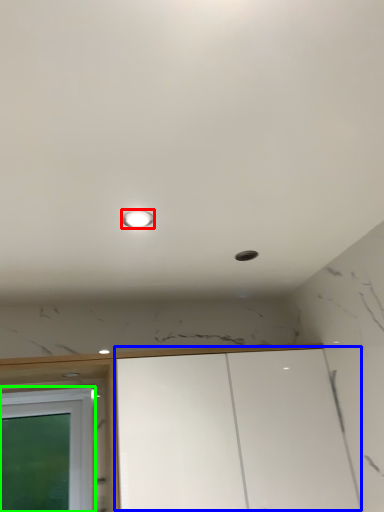
Question: Considering the real-world distances, which object is closest to light (highlighted by a red box)? cabinetry (highlighted by a blue box) or window (highlighted by a green box).

Choices:
 (A) cabinetry
 (B) window

Answer: (A)